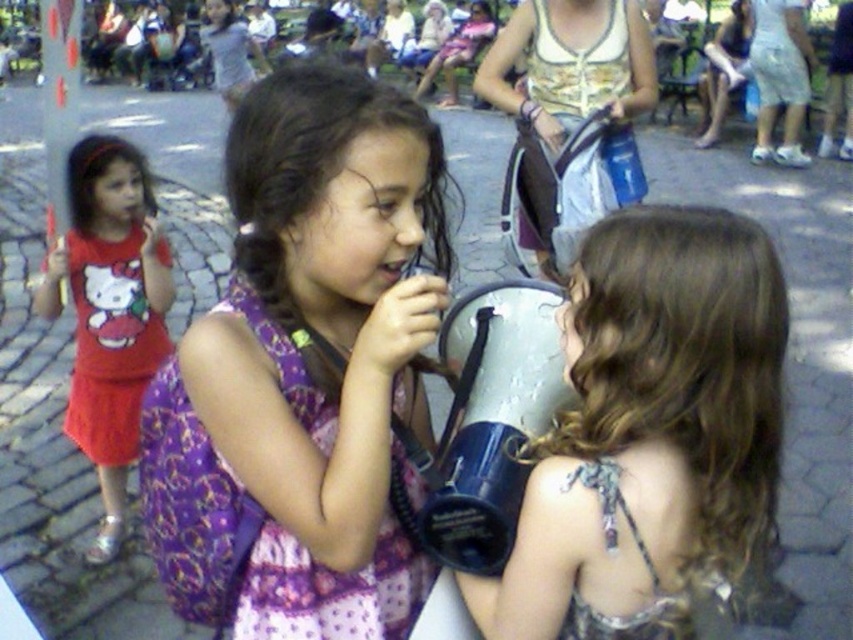
Question: Considering the relative positions of purple satin dress at center and matte red dress at left in the image provided, where is purple satin dress at center located with respect to matte red dress at left?

Choices:
 (A) left
 (B) right

Answer: (B)

Question: Can you confirm if purple satin dress at center is bigger than shiny silver megaphone at center?

Choices:
 (A) no
 (B) yes

Answer: (B)

Question: Among these points, which one is farthest from the camera?

Choices:
 (A) [247, 272]
 (B) [612, 595]

Answer: (A)

Question: In this image, where is purple satin dress at center located relative to matte red dress at left?

Choices:
 (A) below
 (B) above

Answer: (A)

Question: Which point appears closest to the camera in this image?

Choices:
 (A) (312, 266)
 (B) (169, 348)
 (C) (699, 573)

Answer: (C)

Question: Which object is the closest to the shiny silver megaphone at center?

Choices:
 (A) matte red dress at left
 (B) purple satin dress at center

Answer: (B)